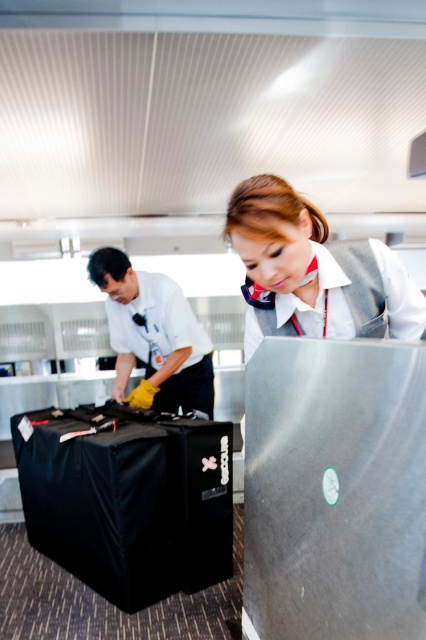
Does gray fabric vest at center appear on the right side of yellow rubber gloves at left?

Indeed, gray fabric vest at center is positioned on the right side of yellow rubber gloves at left.

Is point (287, 298) positioned behind point (172, 362)?

That is False.

Which is in front, point (340, 285) or point (164, 332)?

Point (340, 285)

Locate an element on the screen. The image size is (426, 640). gray fabric vest at center is located at coordinates (311, 269).